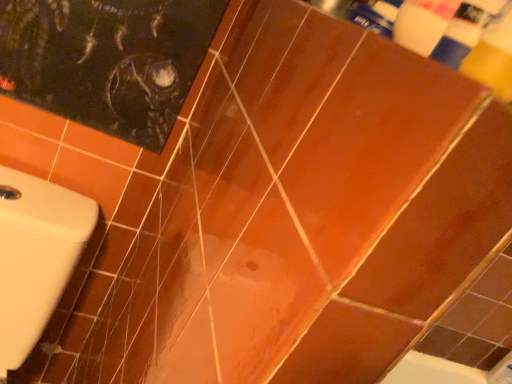
Find the location of a particular element. This screenshot has width=512, height=384. white glossy toilet at lower left is located at coordinates (36, 256).

What do you see at coordinates (36, 256) in the screenshot? I see `white glossy toilet at lower left` at bounding box center [36, 256].

Identify the location of white glossy toilet at lower left. This screenshot has width=512, height=384. (36, 256).